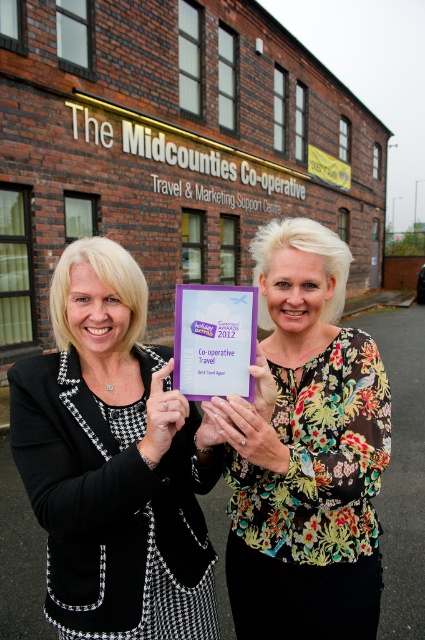
Question: Which point is farther to the camera?

Choices:
 (A) (231, 289)
 (B) (153, 573)
 (C) (376, 486)

Answer: (B)

Question: Does floral print blouse at center appear on the left side of purple paper plaque at center?

Choices:
 (A) no
 (B) yes

Answer: (A)

Question: From the image, what is the correct spatial relationship of black houndstooth blazer at center in relation to floral print blouse at center?

Choices:
 (A) below
 (B) above

Answer: (A)

Question: Which is nearer to the black houndstooth blazer at center?

Choices:
 (A) purple paper plaque at center
 (B) floral print blouse at center

Answer: (A)

Question: Which of the following is the farthest from the observer?

Choices:
 (A) [x=306, y=252]
 (B) [x=119, y=326]
 (C) [x=203, y=372]

Answer: (A)

Question: Is black houndstooth blazer at center wider than floral print blouse at center?

Choices:
 (A) yes
 (B) no

Answer: (A)